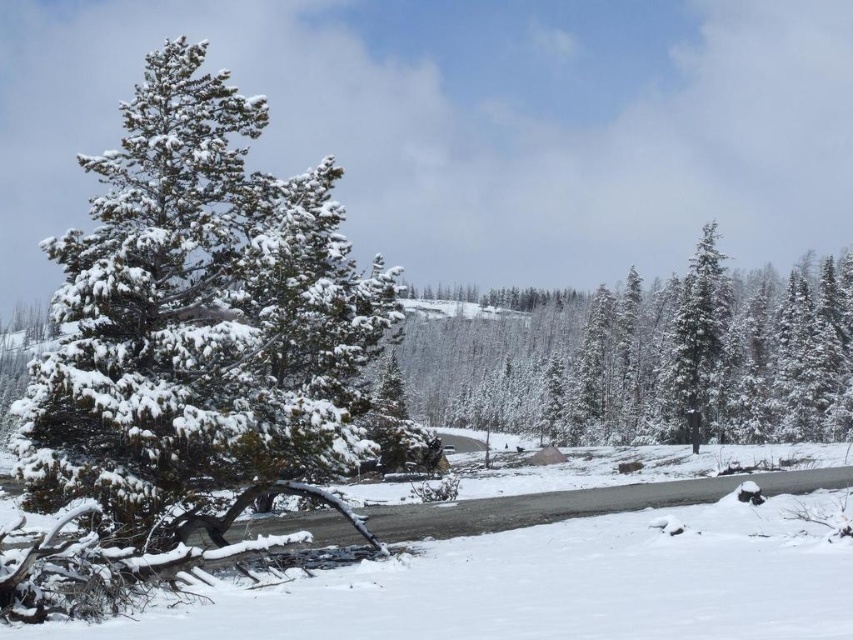
Question: Among these objects, which one is farthest from the camera?

Choices:
 (A) white snow at center
 (B) snow-covered pine tree at left
 (C) green textured pine tree at center

Answer: (C)

Question: Is snow-covered pine tree at left closer to the viewer compared to green textured pine tree at center?

Choices:
 (A) no
 (B) yes

Answer: (B)

Question: Which is nearer to the snow-covered evergreen at right?

Choices:
 (A) white snow at center
 (B) snow-covered pine tree at left

Answer: (A)

Question: Is snow-covered pine tree at left above green textured pine tree at center?

Choices:
 (A) yes
 (B) no

Answer: (B)

Question: Among these points, which one is farthest from the camera?

Choices:
 (A) (433, 358)
 (B) (194, 509)
 (C) (587, 628)

Answer: (A)

Question: Observing the image, what is the correct spatial positioning of white snow at center in reference to snow-covered evergreen at right?

Choices:
 (A) left
 (B) right

Answer: (A)